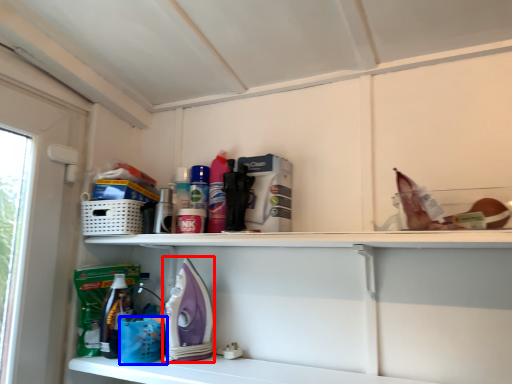
Question: Which point is closer to the camera, appliance (highlighted by a red box) or basket (highlighted by a blue box)?

Choices:
 (A) appliance
 (B) basket

Answer: (A)